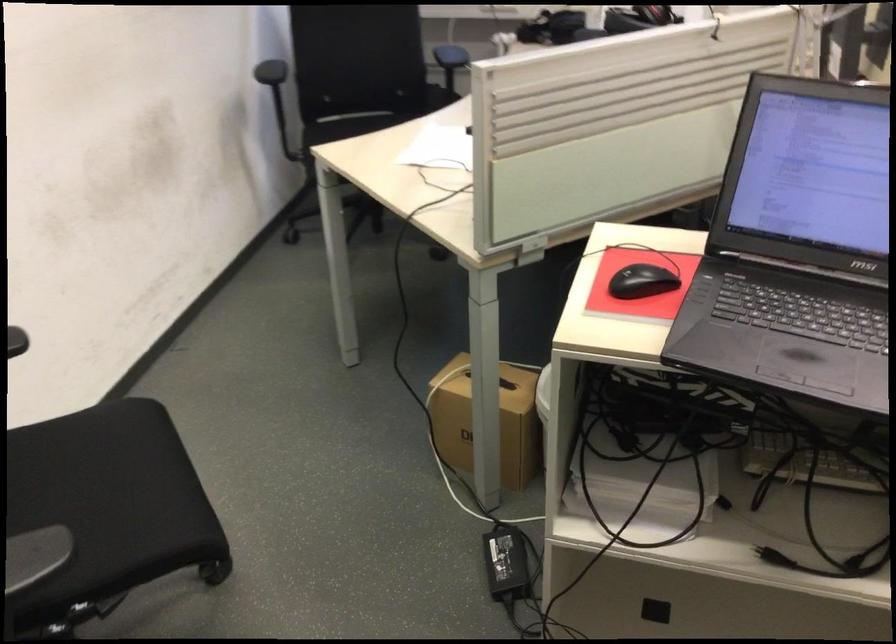
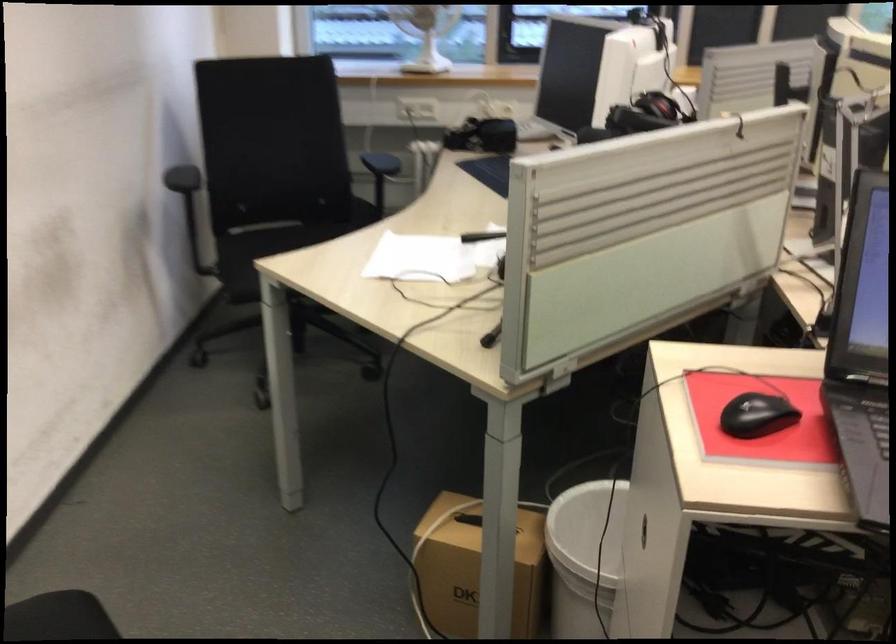
Question: The first image is from the beginning of the video and the second image is from the end. How did the camera likely rotate when shooting the video?

Choices:
 (A) Left
 (B) Right
 (C) Up
 (D) Down

Answer: (B)